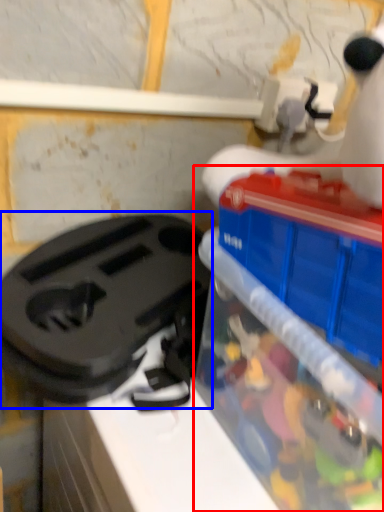
Question: Which of the following is the closest to the observer, toy (highlighted by a red box) or appliance (highlighted by a blue box)?

Choices:
 (A) toy
 (B) appliance

Answer: (A)